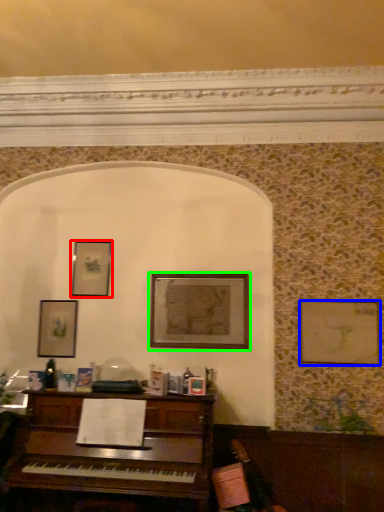
Question: Considering the real-world distances, which object is closest to picture frame (highlighted by a red box)? picture frame (highlighted by a blue box) or picture frame (highlighted by a green box).

Choices:
 (A) picture frame
 (B) picture frame

Answer: (B)